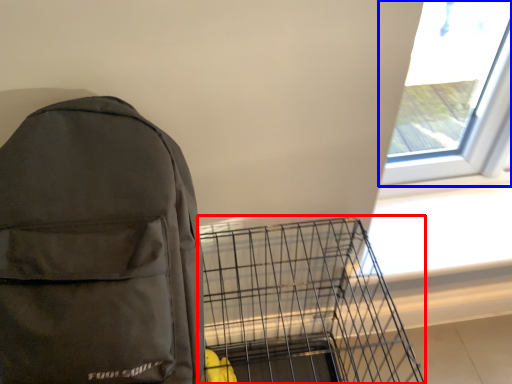
Question: Which point is closer to the camera, bird cage (highlighted by a red box) or window (highlighted by a blue box)?

Choices:
 (A) bird cage
 (B) window

Answer: (A)